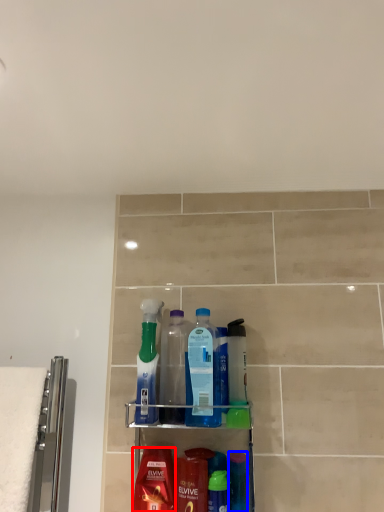
Question: Which of the following is the farthest to the observer, mouthwash (highlighted by a red box) or mouthwash (highlighted by a blue box)?

Choices:
 (A) mouthwash
 (B) mouthwash

Answer: (B)